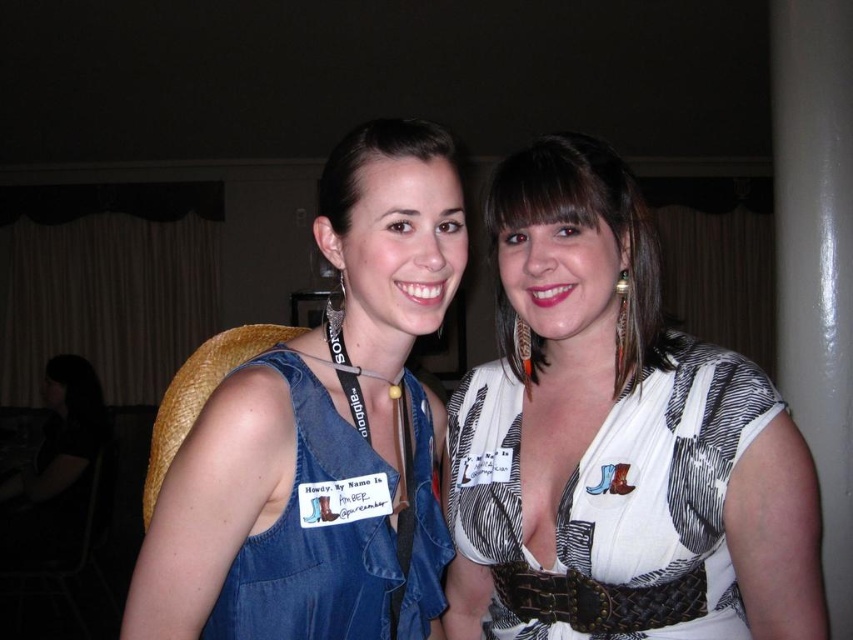
You are a photographer trying to adjust the lighting for a group photo. You notice the white printed dress at center and the denim vest at left. Which clothing item is located to the right of the other?

The white printed dress at center is positioned on the right side of the denim vest at left.

You are a fashion designer analyzing the outfits in the image. Which of the two items, the denim dress at center or the white textured blouse at center, would you say is longer?

The denim dress at center has a greater height compared to the white textured blouse at center, so the denim dress at center is longer.